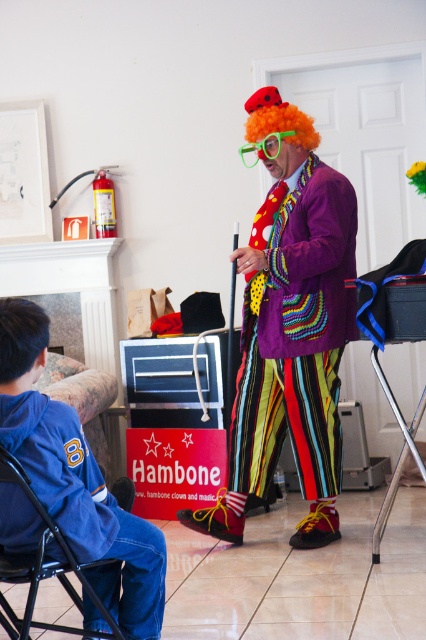
From the picture: Does multicolored striped pants at center lie behind orange curly wig at center?

That is False.

Is multicolored striped pants at center taller than orange curly wig at center?

Yes, multicolored striped pants at center is taller than orange curly wig at center.

Identify the location of multicolored striped pants at center. (290, 342).

Who is lower down, multicolored striped pants at center or blue denim jacket at lower left?

blue denim jacket at lower left

In the scene shown: Can you confirm if multicolored striped pants at center is taller than blue denim jacket at lower left?

Yes.

Who is more forward, (321, 429) or (31, 419)?

Point (31, 419)

Locate an element on the screen. The height and width of the screenshot is (640, 426). multicolored striped pants at center is located at coordinates (290, 342).

Which is below, blue denim jacket at lower left or blue fabric folding chair at lower left?

blue fabric folding chair at lower left

Is blue denim jacket at lower left below blue fabric folding chair at lower left?

Actually, blue denim jacket at lower left is above blue fabric folding chair at lower left.

Where is `blue denim jacket at lower left`? blue denim jacket at lower left is located at coordinates (75, 480).